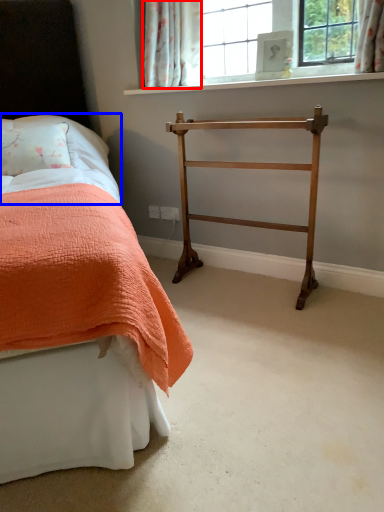
Question: Which of the following is the farthest to the observer, curtain (highlighted by a red box) or sheet (highlighted by a blue box)?

Choices:
 (A) curtain
 (B) sheet

Answer: (A)